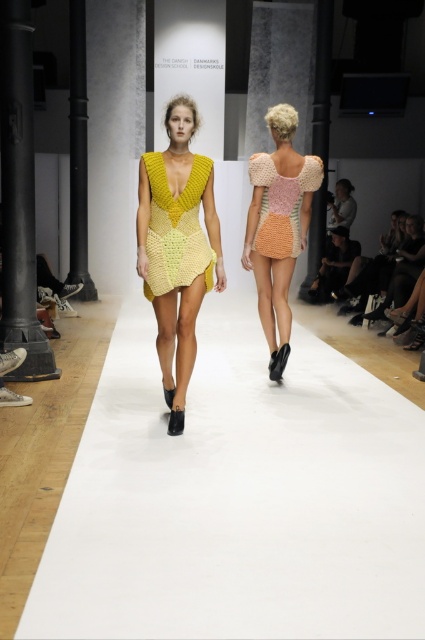
Where is the yellow knitted dress at center located in the image?

The yellow knitted dress at center is located at point coordinates of (176, 248).

You are a photographer at the runway show. You need to capture a photo where the yellow knitted dress at center and the black metal pole at left are both visible. Based on their heights, which object will appear taller in the photo?

The black metal pole at left will appear taller in the photo because the yellow knitted dress at center is shorter than the black metal pole at left.

You are standing on the runway and see the point at coordinates point (x=181, y=216). If you take a step forward, will you get closer to or farther away from that point?

The point point (x=181, y=216) is 5.17 meters away from viewer. Taking a step forward would decrease the distance, so you would get closer to the point point (x=181, y=216).